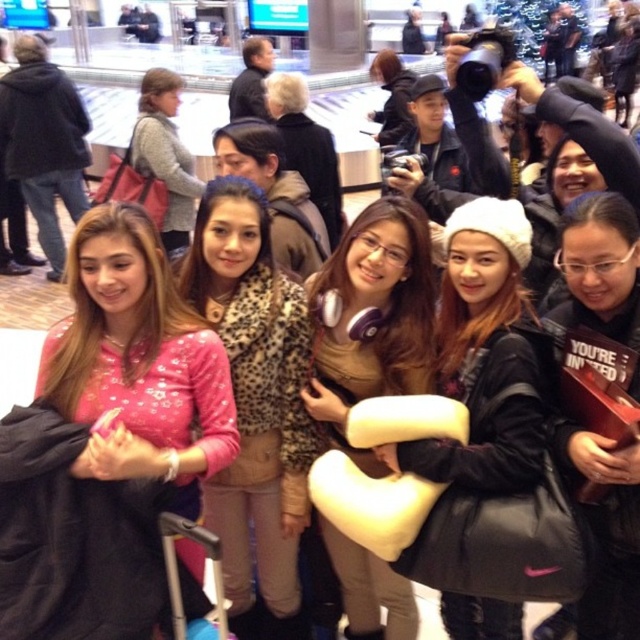
You are a photographer trying to decide how to arrange two subjects wearing the pink leopard print jacket at center and the gray sweater at center. Based on their clothing lengths, which one should you place in a position where a shorter length is better for the composition?

The pink leopard print jacket at center is shorter than the gray sweater at center, so you should place the subject wearing the pink leopard print jacket at center in the position where a shorter length is better for the composition.

You are a photographer trying to frame a shot that includes both the white matte beanie at center and the black matte jacket at center. Since you want to ensure both are clearly visible, which object should you adjust your focus to prioritize in terms of size, and why?

The white matte beanie at center is wider than the black matte jacket at center. Therefore, you should prioritize focusing on the white matte beanie at center because its larger size might require more attention to capture details without cropping.

You are a photographer standing at the center of the airport lobby. You want to capture a photo of the pink leopard print jacket at center. Based on its 2D coordinates, is it positioned closer to the left or right side of the image?

The pink leopard print jacket at center is located at coordinates 0.628 on the x axis, which is closer to the right side of the image.